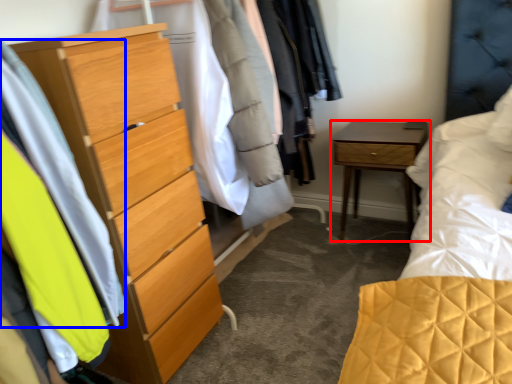
Question: Which point is closer to the camera, nightstand (highlighted by a red box) or clothing (highlighted by a blue box)?

Choices:
 (A) nightstand
 (B) clothing

Answer: (B)